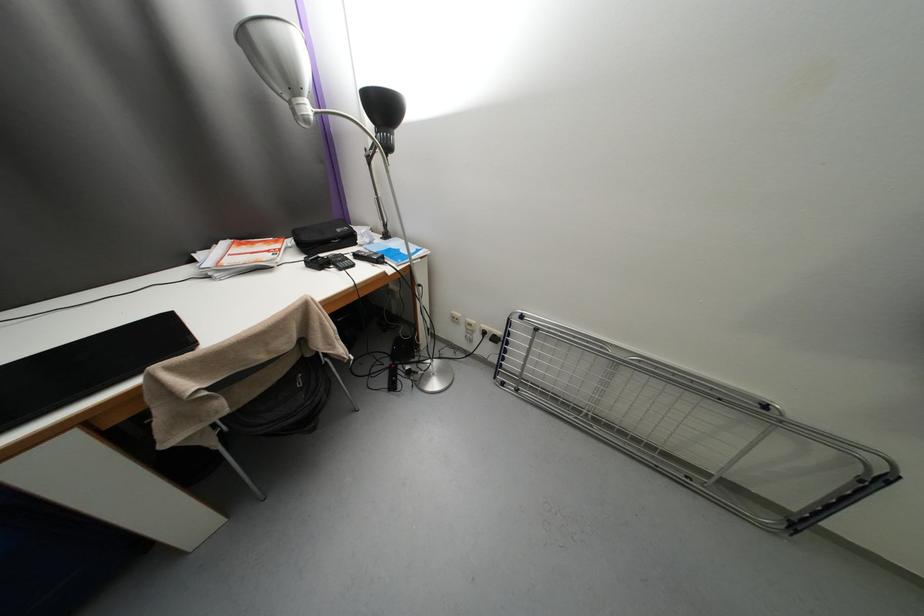
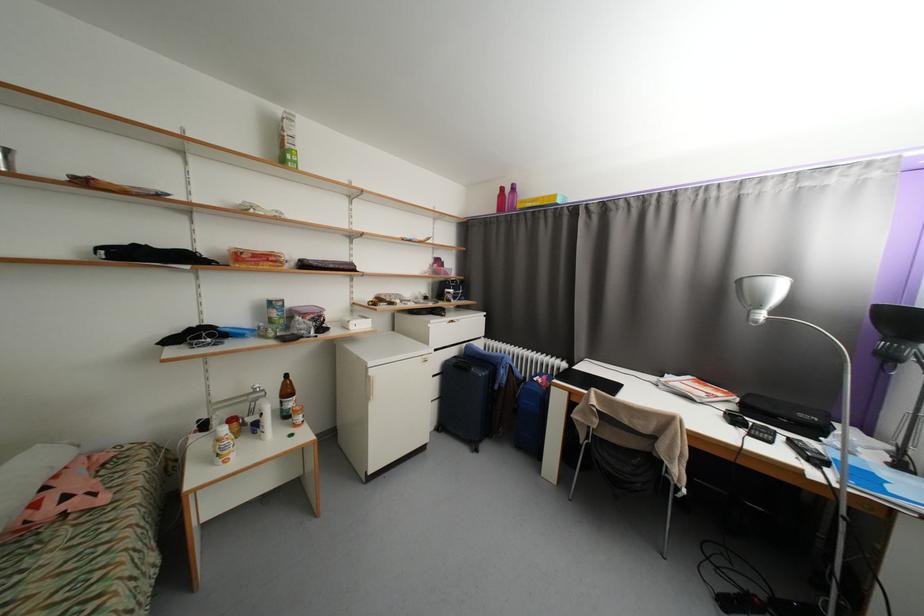
Find the pixel in the second image that matches point 357,257 in the first image.

(787, 439)